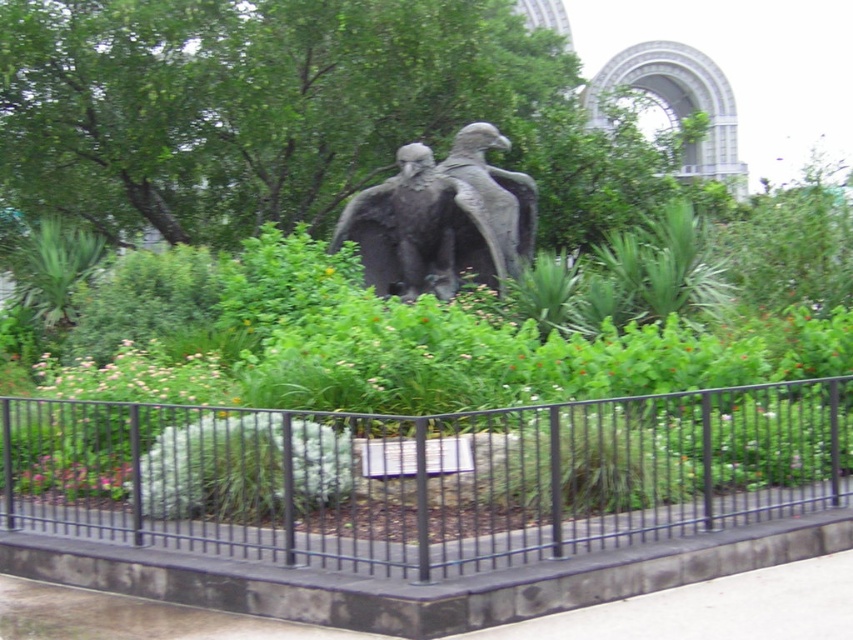
Question: Which object appears farthest from the camera in this image?

Choices:
 (A) green leafy tree at center
 (B) black metal fence at center
 (C) bronze eagle at center
 (D) green leafy bush at center

Answer: (A)

Question: Is green leafy tree at center thinner than gray stone eagle at center?

Choices:
 (A) yes
 (B) no

Answer: (A)

Question: Can you confirm if bronze eagle at center is positioned above gray stone eagle at center?

Choices:
 (A) yes
 (B) no

Answer: (B)

Question: Which of the following is the farthest from the observer?

Choices:
 (A) (486, 246)
 (B) (32, 246)

Answer: (B)

Question: Does black metal fence at center come behind green leafy tree at center?

Choices:
 (A) no
 (B) yes

Answer: (A)

Question: Which of the following is the closest to the observer?

Choices:
 (A) bronze eagle at center
 (B) gray stone eagle at center
 (C) green leafy bush at center
 (D) gray concrete pavement at center

Answer: (D)